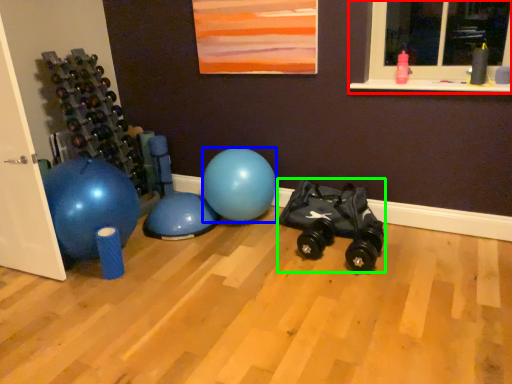
Question: Based on their relative distances, which object is farther from window (highlighted by a red box)? Choose from ball (highlighted by a blue box) and toy car (highlighted by a green box).

Choices:
 (A) ball
 (B) toy car

Answer: (A)